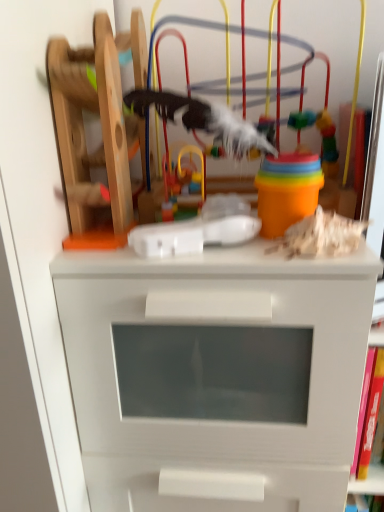
Question: Is multicolored plastic toy at center, which appears as the 3th toy when viewed from the right, thinner than wooden toy at upper right, positioned as the 4th toy in left-to-right order?

Choices:
 (A) no
 (B) yes

Answer: (B)

Question: Considering the relative sizes of multicolored plastic toy at center, which appears as the 3th toy when viewed from the right, and wooden toy at upper right, which appears as the first toy when viewed from the right, in the image provided, is multicolored plastic toy at center, which appears as the 3th toy when viewed from the right, taller than wooden toy at upper right, which appears as the first toy when viewed from the right,?

Choices:
 (A) no
 (B) yes

Answer: (B)

Question: Does multicolored plastic toy at center, which is the 2th toy in left-to-right order, have a lesser height compared to wooden toy at upper right, which appears as the first toy when viewed from the right?

Choices:
 (A) yes
 (B) no

Answer: (B)

Question: Are multicolored plastic toy at center, which appears as the 3th toy when viewed from the right, and wooden toy at upper right, which appears as the first toy when viewed from the right, beside each other?

Choices:
 (A) no
 (B) yes

Answer: (A)

Question: Does multicolored plastic toy at center, which appears as the 3th toy when viewed from the right, have a greater width compared to wooden toy at upper right, which appears as the first toy when viewed from the right?

Choices:
 (A) yes
 (B) no

Answer: (B)

Question: Relative to wooden roller coaster at left, the 1th toy from the left, is wooden toy at upper right, positioned as the 4th toy in left-to-right order, in front or behind?

Choices:
 (A) front
 (B) behind

Answer: (B)

Question: Considering the positions of wooden toy at upper right, positioned as the 4th toy in left-to-right order, and wooden roller coaster at left, which appears as the 4th toy when viewed from the right, in the image, is wooden toy at upper right, positioned as the 4th toy in left-to-right order, bigger or smaller than wooden roller coaster at left, which appears as the 4th toy when viewed from the right,?

Choices:
 (A) small
 (B) big

Answer: (A)

Question: Would you say wooden toy at upper right, positioned as the 4th toy in left-to-right order, is inside or outside wooden roller coaster at left, the 1th toy from the left?

Choices:
 (A) inside
 (B) outside

Answer: (B)

Question: From a real-world perspective, is wooden toy at upper right, which appears as the first toy when viewed from the right, physically located above or below wooden roller coaster at left, the 1th toy from the left?

Choices:
 (A) above
 (B) below

Answer: (B)

Question: In terms of height, does multicolored plastic toy at center, which appears as the 3th toy when viewed from the right, look taller or shorter compared to wooden toy at upper right, positioned as the 4th toy in left-to-right order?

Choices:
 (A) tall
 (B) short

Answer: (A)

Question: From a real-world perspective, is multicolored plastic toy at center, which is the 2th toy in left-to-right order, positioned above or below wooden toy at upper right, which appears as the first toy when viewed from the right?

Choices:
 (A) below
 (B) above

Answer: (B)

Question: Is point (180, 190) positioned closer to the camera than point (317, 251)?

Choices:
 (A) closer
 (B) farther

Answer: (B)

Question: From the image's perspective, is multicolored plastic toy at center, which is the 2th toy in left-to-right order, above or below wooden toy at upper right, which appears as the first toy when viewed from the right?

Choices:
 (A) below
 (B) above

Answer: (B)

Question: Visually, is wooden toy at upper center, which appears as the 3th toy when viewed from the left, positioned to the left or to the right of multicolored plastic toy at center, which is the 2th toy in left-to-right order?

Choices:
 (A) left
 (B) right

Answer: (B)

Question: Is wooden toy at upper center, the second toy positioned from the right, bigger or smaller than multicolored plastic toy at center, which appears as the 3th toy when viewed from the right?

Choices:
 (A) small
 (B) big

Answer: (B)